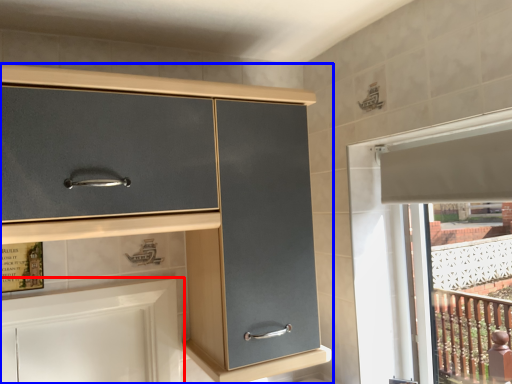
Question: Which point is closer to the camera, cabinetry (highlighted by a red box) or cabinetry (highlighted by a blue box)?

Choices:
 (A) cabinetry
 (B) cabinetry

Answer: (B)